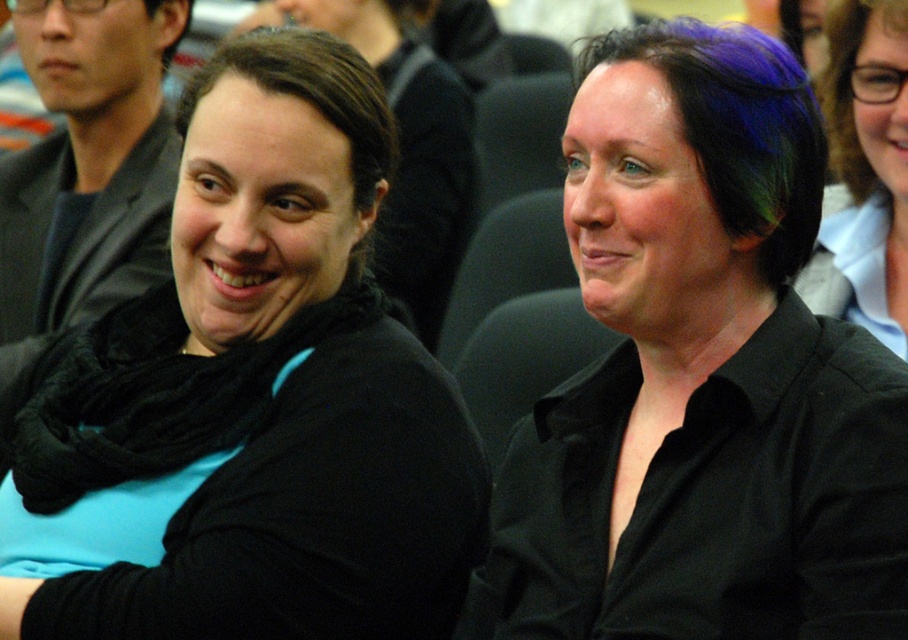
Question: Which object is closer to the camera taking this photo?

Choices:
 (A) purple dyed hair at upper right
 (B) purple hair at upper right

Answer: (A)

Question: Does black matte scarf at left come in front of purple hair at upper right?

Choices:
 (A) no
 (B) yes

Answer: (B)

Question: Which object is positioned farthest from the black matte shirt at center?

Choices:
 (A) black matte scarf at left
 (B) matte black jacket at left

Answer: (B)

Question: From the image, what is the correct spatial relationship of purple dyed hair at upper right in relation to purple hair at upper right?

Choices:
 (A) right
 (B) left

Answer: (B)

Question: Which point is farther from the camera taking this photo?

Choices:
 (A) (873, 628)
 (B) (38, 10)

Answer: (B)

Question: Can you confirm if purple hair at upper right is positioned above brown smooth hair at upper left?

Choices:
 (A) yes
 (B) no

Answer: (A)